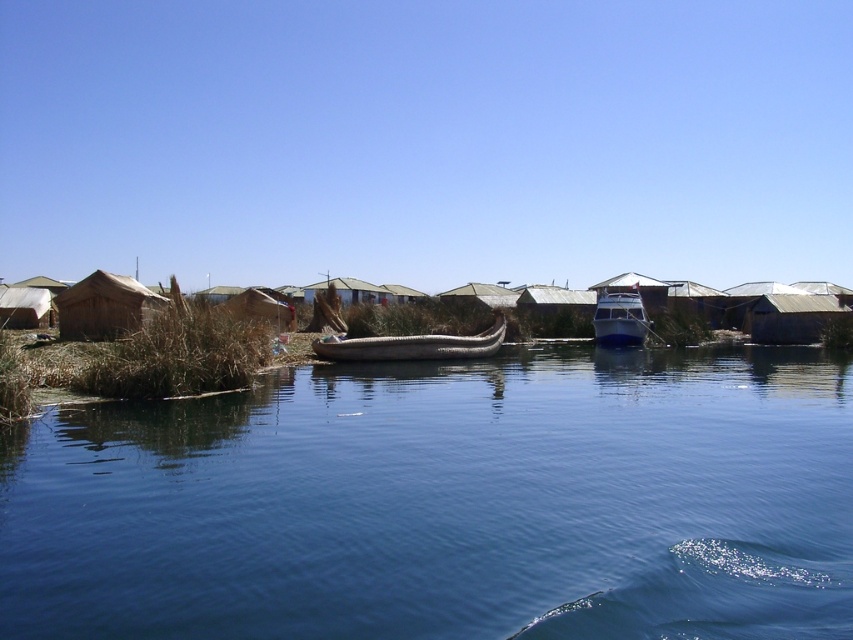
You are standing at the lakeside and want to take a photo of the point at coordinates [517,369]. If your camera has a maximum focus range of 30 meters, will it be able to focus on that point?

The distance of point [517,369] from the camera is 29.56 meters, which is within the camera maximum focus range of 30 meters. Therefore, the camera can focus on that point.

You are standing on the lakeside and see the clear blue water at center and the metallic blue boat at center. Which object is located below the other?

The clear blue water at center is positioned under the metallic blue boat at center, so the water is below the boat.

You are planning to take a photo of the clear blue water at center and the brown woven boat at center from a position where both are visible. Which object will appear larger in the photo?

The clear blue water at center will appear larger in the photo because it is larger in size than the brown woven boat at center.